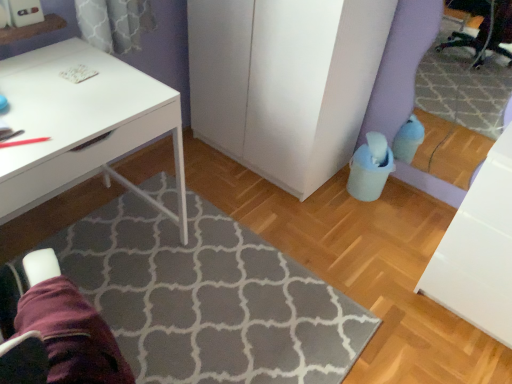
Where is `vacant area situated below gray textured rug at center (from a real-world perspective)`? The image size is (512, 384). vacant area situated below gray textured rug at center (from a real-world perspective) is located at coordinates (237, 301).